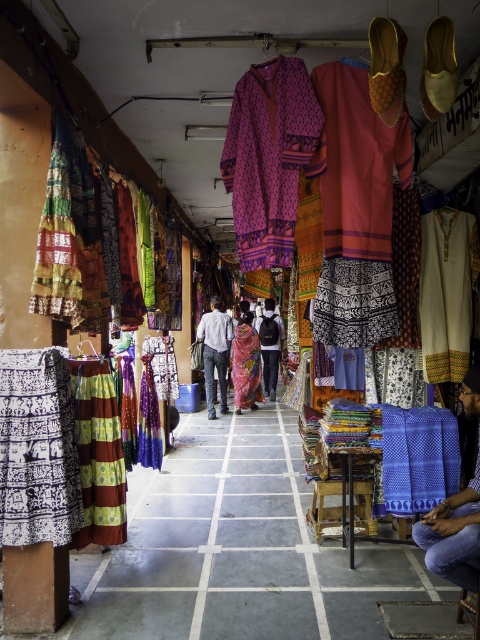
You are a customer in this market looking for a lightweight fabric to make a summer dress. You see the blue woven fabric at lower right and the denim jeans at center. Which fabric would be more suitable for your summer dress?

The blue woven fabric at lower right is thinner than the denim jeans at center, so it would be more suitable for a summer dress as it is lighter and more breathable.

You are a customer in the market and want to compare the height of the two items. Which one is taller between the textured multicolored fabric at left and the floral silk scarf at center?

The floral silk scarf at center is taller than the textured multicolored fabric at left.

You are a customer in the market and want to navigate between the two points marked as point (72, 278) and point (254, 326). Which point is closer to you when standing at the entrance of the corridor?

Point (72, 278) is in front of point (254, 326), so it is closer to you when standing at the entrance of the corridor.